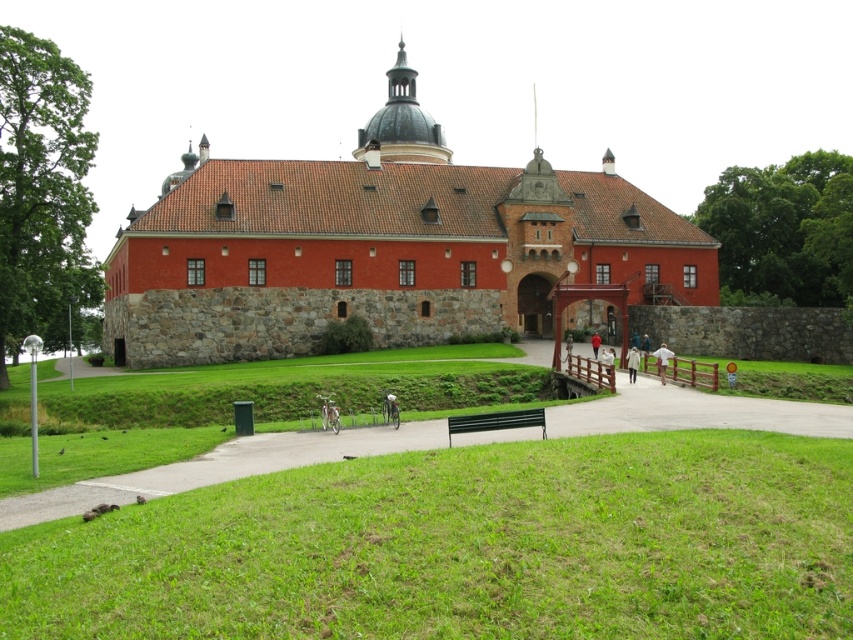
Between green grass at lower center and black plastic bench at lower center, which one has more height?

Standing taller between the two is green grass at lower center.

This screenshot has width=853, height=640. What do you see at coordinates (467, 545) in the screenshot?
I see `green grass at lower center` at bounding box center [467, 545].

Between point (718, 477) and point (485, 416), which one is positioned in front?

Point (718, 477) is more forward.

In order to click on green grass at lower center in this screenshot , I will do `click(467, 545)`.